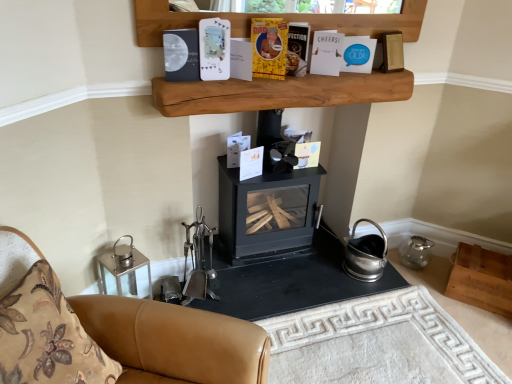
Locate an element on the screen. This screenshot has height=384, width=512. free spot above natural wood shelf at upper center, marked as the first shelf in a top-to-bottom arrangement (from a real-world perspective) is located at coordinates (300, 73).